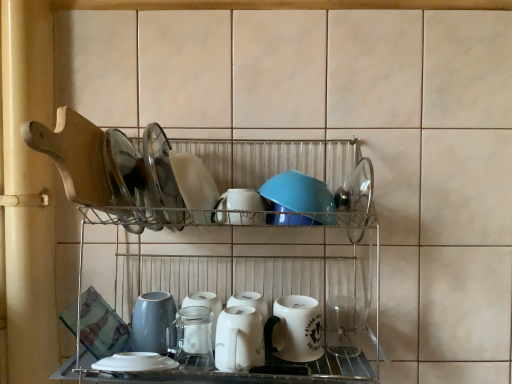
Question: Should I look upward or downward to see white glossy kettle at center, the fourth tableware positioned from the top?

Choices:
 (A) up
 (B) down

Answer: (B)

Question: Is metallic wire rack at center placed right next to white glossy kettle at center, the fourth tableware positioned from the top?

Choices:
 (A) yes
 (B) no

Answer: (B)

Question: Is metallic wire rack at center bigger than white glossy kettle at center, marked as the 1th tableware in a bottom-to-top arrangement?

Choices:
 (A) no
 (B) yes

Answer: (B)

Question: Considering the relative sizes of metallic wire rack at center and white glossy kettle at center, marked as the 1th tableware in a bottom-to-top arrangement, in the image provided, is metallic wire rack at center taller than white glossy kettle at center, marked as the 1th tableware in a bottom-to-top arrangement,?

Choices:
 (A) no
 (B) yes

Answer: (B)

Question: Can you confirm if metallic wire rack at center is shorter than white glossy kettle at center, marked as the 1th tableware in a bottom-to-top arrangement?

Choices:
 (A) no
 (B) yes

Answer: (A)

Question: Is metallic wire rack at center to the right of white glossy kettle at center, the fourth tableware positioned from the top, from the viewer's perspective?

Choices:
 (A) yes
 (B) no

Answer: (B)

Question: From a real-world perspective, is metallic wire rack at center below white glossy kettle at center, the fourth tableware positioned from the top?

Choices:
 (A) yes
 (B) no

Answer: (B)

Question: Is white glossy plate at center, arranged as the fourth tableware when ordered from the bottom, outside white glossy kettle at center, the fourth tableware positioned from the top?

Choices:
 (A) no
 (B) yes

Answer: (B)

Question: Is white glossy plate at center, which appears as the first tableware when viewed from the top, looking in the opposite direction of white glossy kettle at center, marked as the 1th tableware in a bottom-to-top arrangement?

Choices:
 (A) yes
 (B) no

Answer: (B)

Question: Does white glossy plate at center, which appears as the first tableware when viewed from the top, lie behind white glossy kettle at center, the fourth tableware positioned from the top?

Choices:
 (A) yes
 (B) no

Answer: (A)

Question: From a real-world perspective, is white glossy plate at center, arranged as the fourth tableware when ordered from the bottom, physically below white glossy kettle at center, marked as the 1th tableware in a bottom-to-top arrangement?

Choices:
 (A) yes
 (B) no

Answer: (B)

Question: Is white glossy plate at center, arranged as the fourth tableware when ordered from the bottom, at the left side of white glossy kettle at center, marked as the 1th tableware in a bottom-to-top arrangement?

Choices:
 (A) no
 (B) yes

Answer: (B)

Question: Is white glossy kettle at center, marked as the 1th tableware in a bottom-to-top arrangement, surrounded by white glossy plate at center, arranged as the fourth tableware when ordered from the bottom?

Choices:
 (A) yes
 (B) no

Answer: (B)

Question: Does metallic wire rack at center have a smaller size compared to white glossy mug at lower center?

Choices:
 (A) no
 (B) yes

Answer: (A)